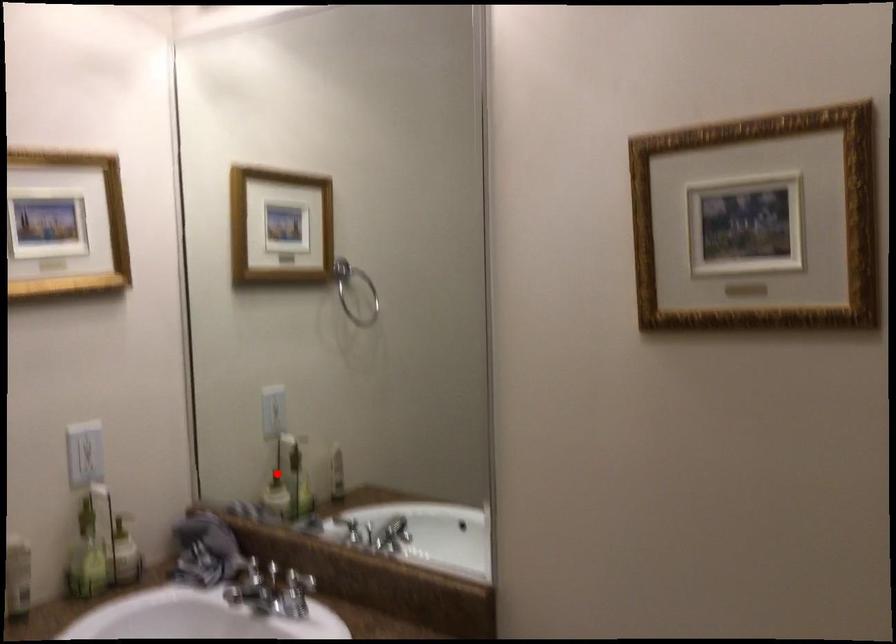
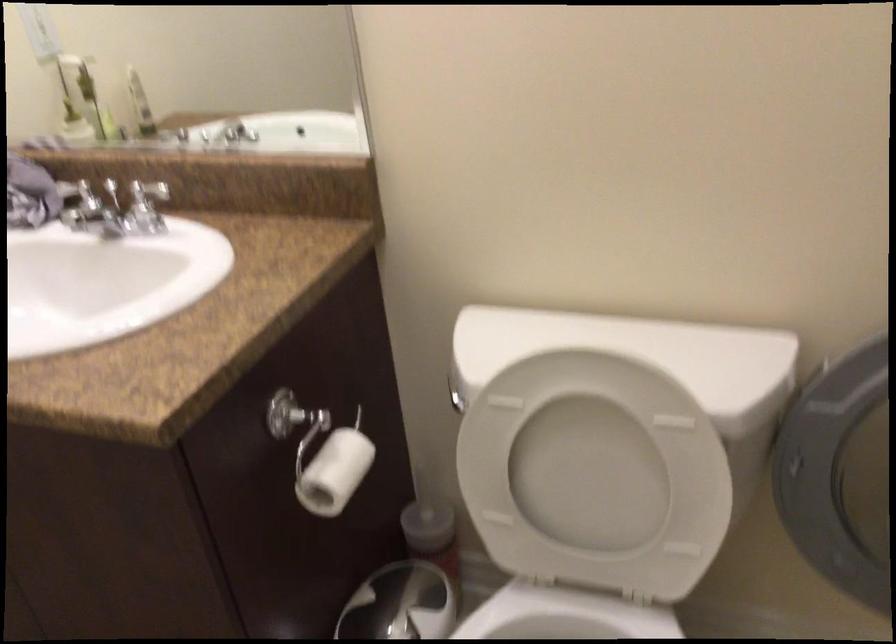
Where in the second image is the point corresponding to the highlighted location from the first image?

(70, 111)